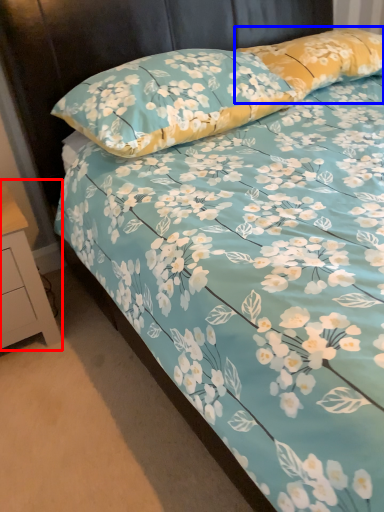
Question: Among these objects, which one is nearest to the camera, nightstand (highlighted by a red box) or pillow (highlighted by a blue box)?

Choices:
 (A) nightstand
 (B) pillow

Answer: (A)